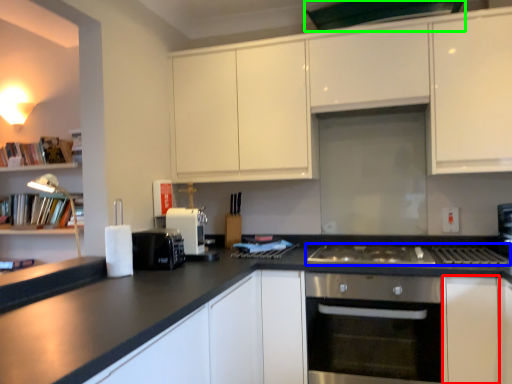
Question: Which is farther away from cabinetry (highlighted by a red box)? gas stove (highlighted by a blue box) or exhaust hood (highlighted by a green box)?

Choices:
 (A) gas stove
 (B) exhaust hood

Answer: (B)